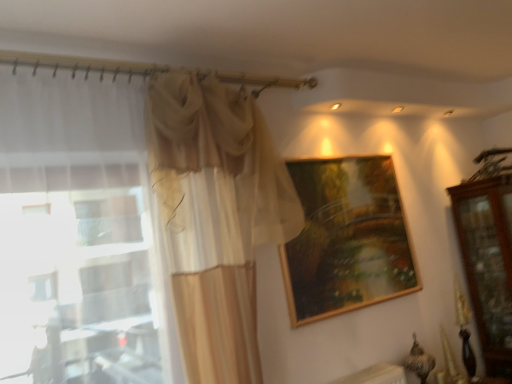
Question: Is mahogany wooden dresser at right situated inside sheer beige curtain at left or outside?

Choices:
 (A) inside
 (B) outside

Answer: (B)

Question: Is mahogany wooden dresser at right taller or shorter than sheer beige curtain at left?

Choices:
 (A) short
 (B) tall

Answer: (A)

Question: Which object is positioned closest to the mahogany wooden dresser at right?

Choices:
 (A) wooden frame at upper center
 (B) sheer beige curtain at left

Answer: (A)

Question: Which object is the farthest from the sheer beige curtain at left?

Choices:
 (A) wooden frame at upper center
 (B) mahogany wooden dresser at right

Answer: (B)